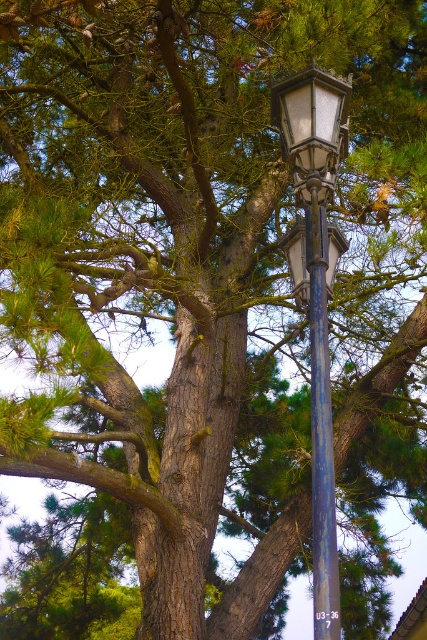
Who is shorter, matte black street light at center or matte glass streetlamp at center?

Standing shorter between the two is matte glass streetlamp at center.

Who is higher up, matte black street light at center or matte glass streetlamp at center?

matte glass streetlamp at center

Is point (301, 182) closer to viewer compared to point (307, 276)?

Yes, point (301, 182) is closer to viewer.

I want to click on matte black street light at center, so click(x=316, y=292).

How distant is matte black street light at center from rusty metal pole at center?

They are 5.39 inches apart.

Who is more distant from viewer, (325, 225) or (312, 208)?

Point (325, 225)

Who is more distant from viewer, (318, 410) or (327, 602)?

Positioned behind is point (318, 410).

This screenshot has height=640, width=427. Find the location of `matte black street light at center`. matte black street light at center is located at coordinates (316, 292).

Describe the element at coordinates (321, 429) in the screenshot. The image size is (427, 640). I see `rusty metal pole at center` at that location.

Between rusty metal pole at center and matte glass streetlamp at center, which one has less height?

With less height is matte glass streetlamp at center.

The width and height of the screenshot is (427, 640). What are the coordinates of `rusty metal pole at center` in the screenshot? It's located at (321, 429).